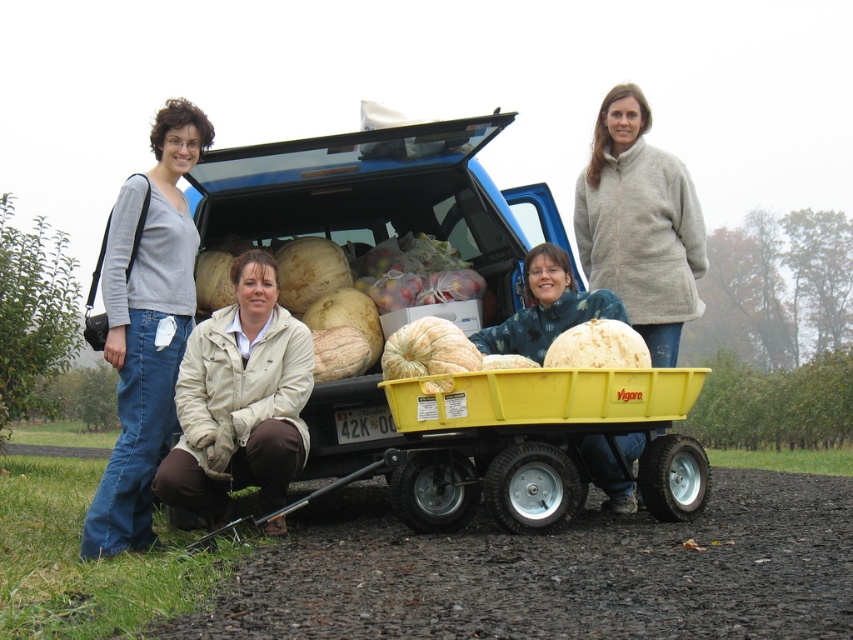
You are helping to organize items in the truck bed. You need to place both the gray fleece jacket at center and the smooth white pumpkin at center into the truck bed. Which item should you place first to maximize space efficiency?

The gray fleece jacket at center is wider than the smooth white pumpkin at center. To maximize space efficiency, you should place the wider item first, so place the gray fleece jacket at center first.

You are standing near the blue pickup truck and see the matte gray sweater at left and the smooth white pumpkin at center. Which object is positioned farther to the east?

The smooth white pumpkin at center is farther to the east because the matte gray sweater at left is to the left of it, and in the scene, left typically corresponds to the east direction when facing the truck.

You are standing in front of the blue pickup truck and looking at the two points marked on the image. Which point, point (x=653, y=193) or point (x=619, y=339), is closer to you?

Point (x=653, y=193) is further to the camera than point (x=619, y=339), so the point closer to you is point (x=619, y=339).